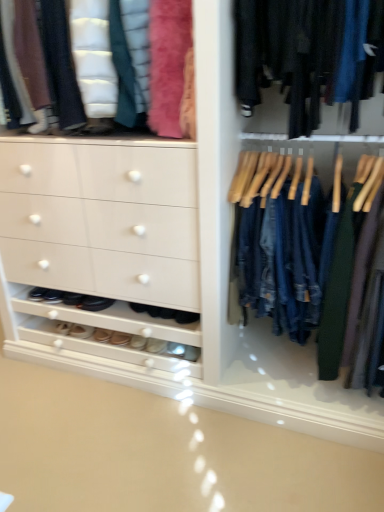
What do you see at coordinates (138, 342) in the screenshot? The image size is (384, 512). I see `leather shoes at lower center, arranged as the second footwear when viewed from the right` at bounding box center [138, 342].

Image resolution: width=384 pixels, height=512 pixels. Describe the element at coordinates (81, 331) in the screenshot. I see `white leather shoe at lower left, marked as the sixth footwear in a right-to-left arrangement` at that location.

Identify the location of white leather shoe at lower left, marked as the sixth footwear in a right-to-left arrangement. (81, 331).

What are the coordinates of `white leather shoe at lower center, acting as the 3th footwear starting from the right` in the screenshot? It's located at (x=119, y=338).

In order to click on leather shoes at lower center, which is the fifth footwear from left to right in this screenshot , I will do `click(138, 342)`.

At what (x,y) coordinates should I click in order to perform the action: click on closet above the white leather shoe at lower left, marked as the first footwear in a left-to-right arrangement (from the image's perspective). Please return your answer as a coordinate pair (x, y). Looking at the image, I should click on (298, 247).

How much distance is there between denim jeans at center and white leather shoe at lower left, marked as the first footwear in a left-to-right arrangement?

denim jeans at center is 3.69 feet from white leather shoe at lower left, marked as the first footwear in a left-to-right arrangement.

How many degrees apart are the facing directions of denim jeans at center and white leather shoe at lower left, marked as the sixth footwear in a right-to-left arrangement?

The facing directions of denim jeans at center and white leather shoe at lower left, marked as the sixth footwear in a right-to-left arrangement, are 0.163 degrees apart.

Is denim jeans at center oriented away from white leather shoe at lower left, marked as the first footwear in a left-to-right arrangement?

No, denim jeans at center's orientation is not away from white leather shoe at lower left, marked as the first footwear in a left-to-right arrangement.

From the image's perspective, is suede beige shoe at lower center, which is counted as the sixth footwear, starting from the left, located beneath suede beige shoe at lower center, arranged as the fourth footwear when viewed from the right?

Yes.

Would you say suede beige shoe at lower center, which is counted as the sixth footwear, starting from the left, is to the left or to the right of suede beige shoe at lower center, marked as the 3th footwear in a left-to-right arrangement, in the picture?

suede beige shoe at lower center, which is counted as the sixth footwear, starting from the left, is to the right of suede beige shoe at lower center, marked as the 3th footwear in a left-to-right arrangement.

I want to click on the 4th footwear behind the suede beige shoe at lower center, which is counted as the sixth footwear, starting from the left, so click(102, 335).

Which is in front, point (151, 346) or point (104, 339)?

Point (151, 346)

How far apart are suede beige shoe at lower center, positioned as the 1th footwear in right-to-left order, and white leather shoe at lower center, acting as the 3th footwear starting from the right?

suede beige shoe at lower center, positioned as the 1th footwear in right-to-left order, is 5.28 inches away from white leather shoe at lower center, acting as the 3th footwear starting from the right.

Is point (153, 338) closer or farther from the camera than point (113, 332)?

Point (153, 338).

Considering the sizes of objects suede beige shoe at lower center, positioned as the 1th footwear in right-to-left order, and white leather shoe at lower center, acting as the 3th footwear starting from the right, in the image provided, who is smaller, suede beige shoe at lower center, positioned as the 1th footwear in right-to-left order, or white leather shoe at lower center, acting as the 3th footwear starting from the right,?

With smaller size is suede beige shoe at lower center, positioned as the 1th footwear in right-to-left order.

Is suede beige shoe at lower center, positioned as the 1th footwear in right-to-left order, oriented towards white leather shoe at lower center, acting as the 3th footwear starting from the right?

No, suede beige shoe at lower center, positioned as the 1th footwear in right-to-left order, is not facing towards white leather shoe at lower center, acting as the 3th footwear starting from the right.

Considering the sizes of objects white leather shoe at lower left, marked as the first footwear in a left-to-right arrangement, and velvet-like pink scarf at upper left in the image provided, who is wider, white leather shoe at lower left, marked as the first footwear in a left-to-right arrangement, or velvet-like pink scarf at upper left?

velvet-like pink scarf at upper left.

Does white leather shoe at lower left, marked as the sixth footwear in a right-to-left arrangement, turn towards velvet-like pink scarf at upper left?

No, white leather shoe at lower left, marked as the sixth footwear in a right-to-left arrangement, is not turned towards velvet-like pink scarf at upper left.

From a real-world perspective, does white leather shoe at lower left, marked as the sixth footwear in a right-to-left arrangement, sit lower than velvet-like pink scarf at upper left?

Correct, in the physical world, white leather shoe at lower left, marked as the sixth footwear in a right-to-left arrangement, is lower than velvet-like pink scarf at upper left.

Is black leather shoes at lower left, the 5th footwear positioned from the right, looking in the opposite direction of white leather shoe at lower left, marked as the sixth footwear in a right-to-left arrangement?

No.

Is black leather shoes at lower left, the 5th footwear positioned from the right, smaller than white leather shoe at lower left, marked as the first footwear in a left-to-right arrangement?

Incorrect, black leather shoes at lower left, the 5th footwear positioned from the right, is not smaller in size than white leather shoe at lower left, marked as the first footwear in a left-to-right arrangement.

Would you say black leather shoes at lower left, which ranks as the 2th footwear in left-to-right order, is to the left or to the right of white leather shoe at lower left, marked as the first footwear in a left-to-right arrangement, in the picture?

Based on their positions, black leather shoes at lower left, which ranks as the 2th footwear in left-to-right order, is located to the right of white leather shoe at lower left, marked as the first footwear in a left-to-right arrangement.

Is suede beige shoe at lower center, marked as the 3th footwear in a left-to-right arrangement, positioned beyond the bounds of velvet-like pink scarf at upper left?

That's correct, suede beige shoe at lower center, marked as the 3th footwear in a left-to-right arrangement, is outside of velvet-like pink scarf at upper left.

Can you confirm if suede beige shoe at lower center, arranged as the fourth footwear when viewed from the right, is thinner than velvet-like pink scarf at upper left?

Indeed, suede beige shoe at lower center, arranged as the fourth footwear when viewed from the right, has a lesser width compared to velvet-like pink scarf at upper left.

Is suede beige shoe at lower center, arranged as the fourth footwear when viewed from the right, positioned with its back to velvet-like pink scarf at upper left?

That's not correct — suede beige shoe at lower center, arranged as the fourth footwear when viewed from the right, is not looking away from velvet-like pink scarf at upper left.

Is point (95, 340) less distant than point (158, 80)?

No, (95, 340) is behind (158, 80).

From a real-world perspective, between white leather shoe at lower center, acting as the 4th footwear starting from the left, and velvet-like pink scarf at upper left, who is vertically lower?

white leather shoe at lower center, acting as the 4th footwear starting from the left.

Who is taller, white leather shoe at lower center, acting as the 4th footwear starting from the left, or velvet-like pink scarf at upper left?

velvet-like pink scarf at upper left is taller.

Considering the relative sizes of white leather shoe at lower center, acting as the 4th footwear starting from the left, and velvet-like pink scarf at upper left in the image provided, is white leather shoe at lower center, acting as the 4th footwear starting from the left, thinner than velvet-like pink scarf at upper left?

Yes, white leather shoe at lower center, acting as the 4th footwear starting from the left, is thinner than velvet-like pink scarf at upper left.

The width and height of the screenshot is (384, 512). Find the location of `closet on the right of white leather shoe at lower left, marked as the sixth footwear in a right-to-left arrangement`. closet on the right of white leather shoe at lower left, marked as the sixth footwear in a right-to-left arrangement is located at coordinates (298, 247).

Where is `the 4th footwear behind the suede beige shoe at lower center, which is counted as the sixth footwear, starting from the left, starting your count from the anchor`? The image size is (384, 512). the 4th footwear behind the suede beige shoe at lower center, which is counted as the sixth footwear, starting from the left, starting your count from the anchor is located at coordinates (102, 335).

Consider the image. From the image, which object appears to be nearer to suede beige shoe at lower center, marked as the 3th footwear in a left-to-right arrangement, leather shoes at lower center, which is the fifth footwear from left to right, or white leather shoe at lower left, marked as the sixth footwear in a right-to-left arrangement?

The object closer to suede beige shoe at lower center, marked as the 3th footwear in a left-to-right arrangement, is white leather shoe at lower left, marked as the sixth footwear in a right-to-left arrangement.

Which object lies further to the anchor point denim jeans at center, white leather shoe at lower left, marked as the first footwear in a left-to-right arrangement, or white leather shoe at lower center, acting as the 3th footwear starting from the right?

Based on the image, white leather shoe at lower left, marked as the first footwear in a left-to-right arrangement, appears to be further to denim jeans at center.

Considering their positions, is suede beige shoe at lower center, marked as the 3th footwear in a left-to-right arrangement, positioned further to denim jeans at center than velvet-like pink scarf at upper left?

suede beige shoe at lower center, marked as the 3th footwear in a left-to-right arrangement, is positioned further to the anchor denim jeans at center.

Looking at the image, which one is located further to denim jeans at center, leather shoes at lower center, which is the fifth footwear from left to right, or velvet-like pink scarf at upper left?

Among the two, leather shoes at lower center, which is the fifth footwear from left to right, is located further to denim jeans at center.

Based on their spatial positions, is black leather shoes at lower left, which ranks as the 2th footwear in left-to-right order, or velvet-like pink scarf at upper left further from leather shoes at lower center, arranged as the second footwear when viewed from the right?

velvet-like pink scarf at upper left.

Considering their positions, is leather shoes at lower center, which is the fifth footwear from left to right, positioned closer to white leather shoe at lower left, marked as the first footwear in a left-to-right arrangement, than denim jeans at center?

The object closer to white leather shoe at lower left, marked as the first footwear in a left-to-right arrangement, is leather shoes at lower center, which is the fifth footwear from left to right.

Considering their positions, is white leather shoe at lower left, marked as the first footwear in a left-to-right arrangement, positioned closer to velvet-like pink scarf at upper left than suede beige shoe at lower center, arranged as the fourth footwear when viewed from the right?

suede beige shoe at lower center, arranged as the fourth footwear when viewed from the right, is closer to velvet-like pink scarf at upper left.

Based on their spatial positions, is leather shoes at lower center, arranged as the second footwear when viewed from the right, or black leather shoes at lower left, which ranks as the 2th footwear in left-to-right order, closer to suede beige shoe at lower center, positioned as the 1th footwear in right-to-left order?

Based on the image, leather shoes at lower center, arranged as the second footwear when viewed from the right, appears to be nearer to suede beige shoe at lower center, positioned as the 1th footwear in right-to-left order.

Locate an element on the screen. The width and height of the screenshot is (384, 512). closet between velvet-like pink scarf at upper left and suede beige shoe at lower center, which is counted as the sixth footwear, starting from the left, from top to bottom is located at coordinates (298, 247).

Identify the location of closet between velvet-like pink scarf at upper left and white leather shoe at lower left, marked as the first footwear in a left-to-right arrangement, from top to bottom. The height and width of the screenshot is (512, 384). (298, 247).

Identify the location of footwear located between white leather shoe at lower center, acting as the 3th footwear starting from the right, and suede beige shoe at lower center, which is counted as the sixth footwear, starting from the left, in the left-right direction. This screenshot has height=512, width=384. (138, 342).

What are the coordinates of `closet between velvet-like pink scarf at upper left and white leather shoe at lower center, acting as the 4th footwear starting from the left, vertically` in the screenshot? It's located at 298,247.